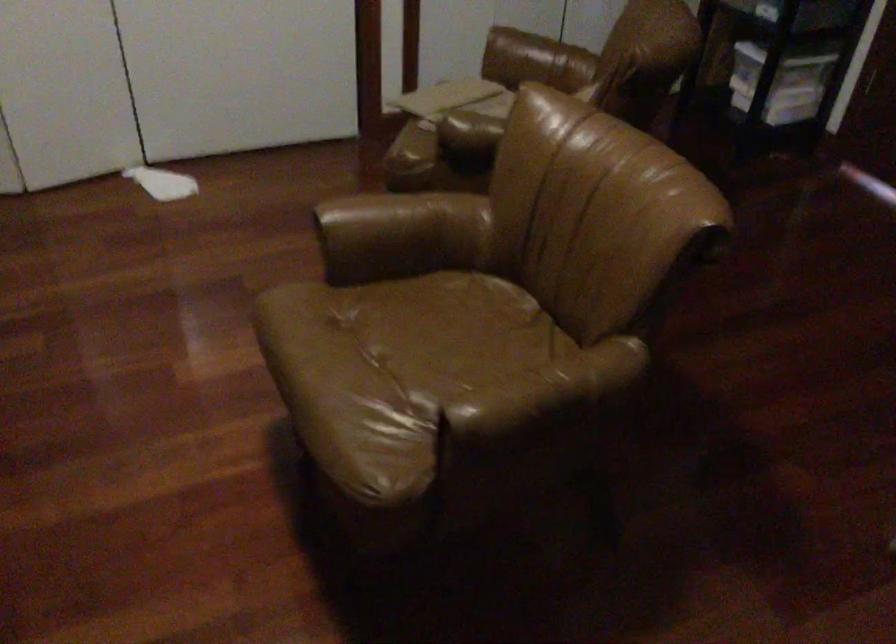
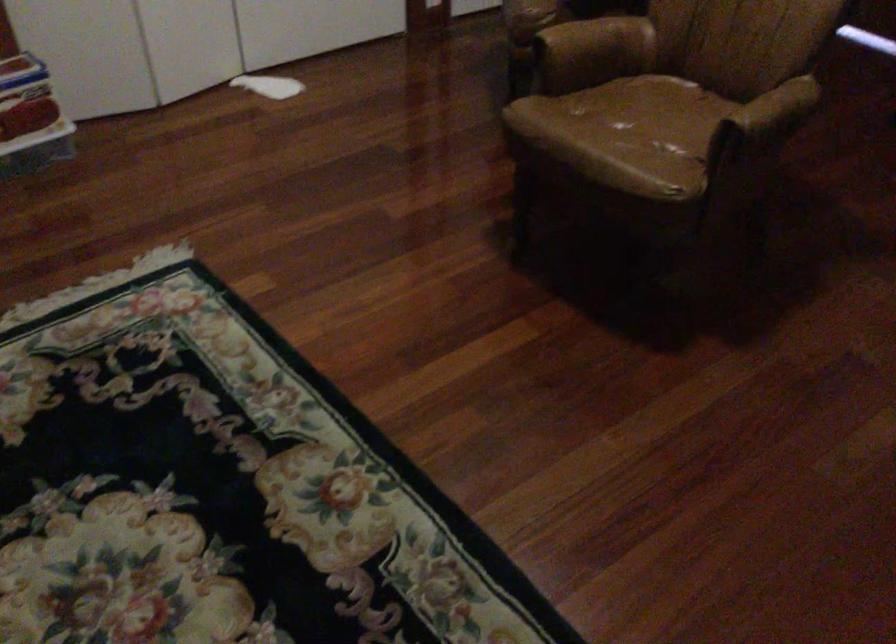
Where in the second image is the point corresponding to (464,335) from the first image?

(661, 109)